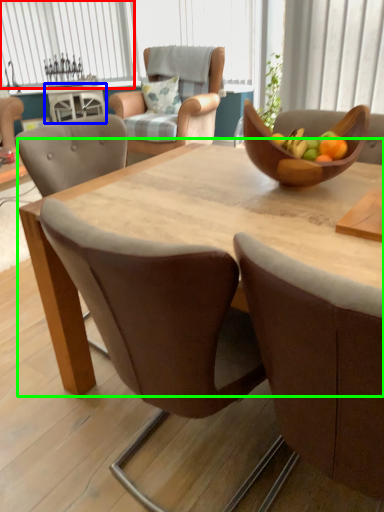
Question: Estimate the real-world distances between objects in this image. Which object is farther from window (highlighted by a red box), coffee table (highlighted by a blue box) or round table (highlighted by a green box)?

Choices:
 (A) coffee table
 (B) round table

Answer: (B)